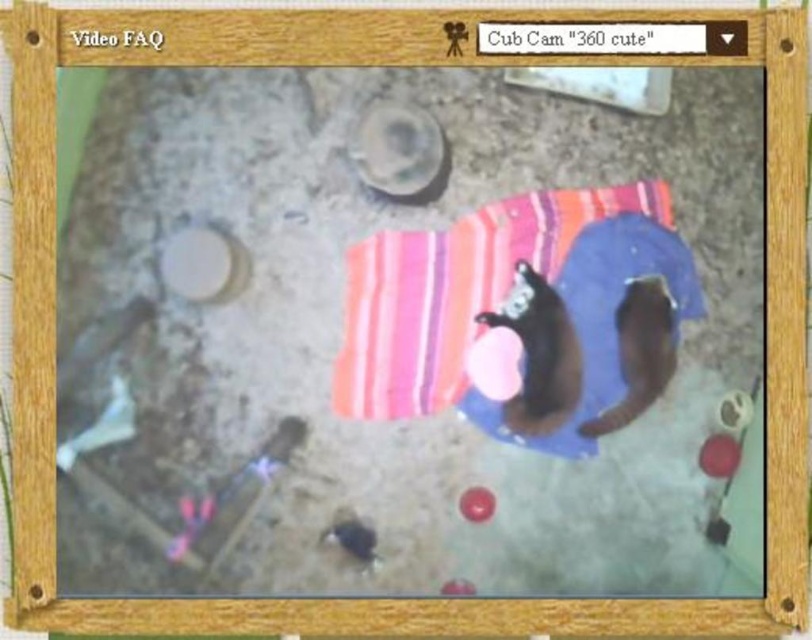
Question: Does soft brown fur cat at center appear over rubber ball at center?

Choices:
 (A) yes
 (B) no

Answer: (A)

Question: Which object appears closest to the camera in this image?

Choices:
 (A) soft brown fur cat at center
 (B) striped cotton beach towel at center

Answer: (B)

Question: From the image, what is the correct spatial relationship of striped cotton beach towel at center in relation to black fur cat at center?

Choices:
 (A) below
 (B) above

Answer: (B)

Question: Does striped cotton beach towel at center have a lesser width compared to rubber ball at center?

Choices:
 (A) no
 (B) yes

Answer: (A)

Question: Among these points, which one is nearest to the camera?

Choices:
 (A) click(540, 340)
 (B) click(469, 301)

Answer: (A)

Question: Which object is farther from the camera taking this photo?

Choices:
 (A) striped cotton beach towel at center
 (B) soft brown fur cat at center
 (C) rubber ball at center

Answer: (B)